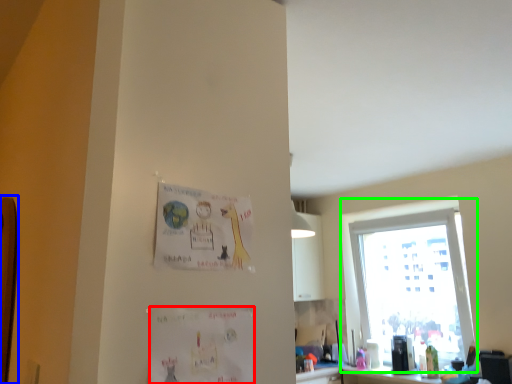
Question: Considering the real-world distances, which object is farthest from postcard (highlighted by a red box)? bulletin board (highlighted by a blue box) or window (highlighted by a green box)?

Choices:
 (A) bulletin board
 (B) window

Answer: (B)